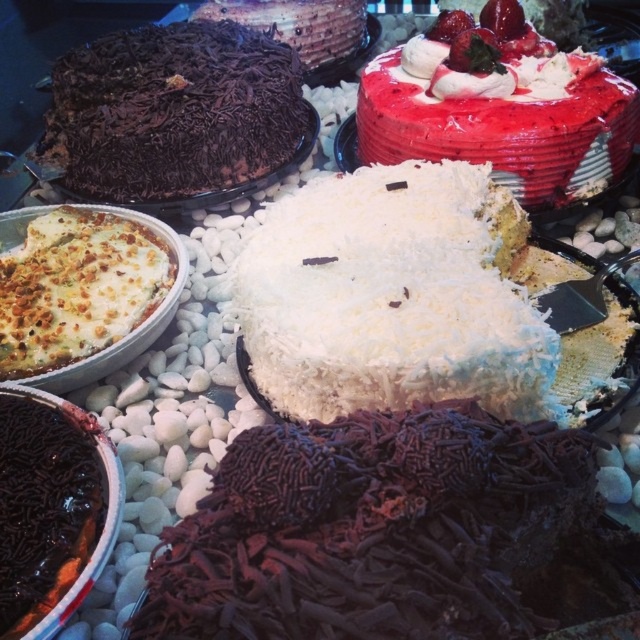
You are a dessert chef who needs to place a new dessert that requires 6 feet of space between it and the white coconut cake at center. Can you place it near the chocolate shavings cake at upper center?

The distance between the white coconut cake at center and the chocolate shavings cake at upper center is 5.51 feet, which is less than the required 6 feet. Therefore, you cannot place the new dessert near the chocolate shavings cake at upper center as it does not meet the spacing requirement.

You are a customer at a dessert display and want to find the dark chocolate cake at upper left. Based on the scene description, where would you look relative to the coconut cake in the foreground?

The dark chocolate cake at upper left is located at point coordinates, but since the scene mentions the coconut cake is in the foreground and the dark chocolate cake is at upper left, you should look towards the upper left direction from the coconut cake in the foreground.